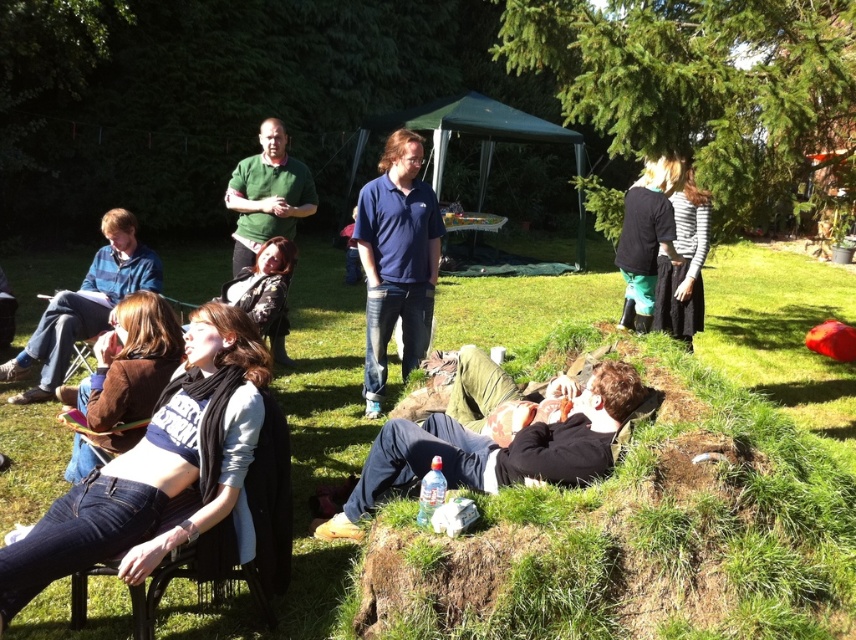
Question: Which of the following is the closest to the observer?

Choices:
 (A) striped cotton shirt at center
 (B) brown soft jacket at lower left

Answer: (B)

Question: Can you confirm if brown soft jacket at lower left is thinner than black fabric jacket at right?

Choices:
 (A) yes
 (B) no

Answer: (B)

Question: Is jeans at lower left positioned in front of blue cotton shirt at center?

Choices:
 (A) yes
 (B) no

Answer: (A)

Question: Estimate the real-world distances between objects in this image. Which object is farther from the brown sweater at left?

Choices:
 (A) brown soft jacket at lower left
 (B) black cotton shirt at lower center
 (C) striped cotton shirt at center
 (D) black fabric jacket at right

Answer: (C)

Question: Which point is farther to the camera?

Choices:
 (A) striped cotton shirt at center
 (B) blue cotton shirt at center
 (C) jeans at lower left
 (D) black cotton shirt at lower center

Answer: (A)

Question: From the image, what is the correct spatial relationship of green matte shirt at upper center in relation to striped cotton shirt at center?

Choices:
 (A) right
 (B) left

Answer: (B)